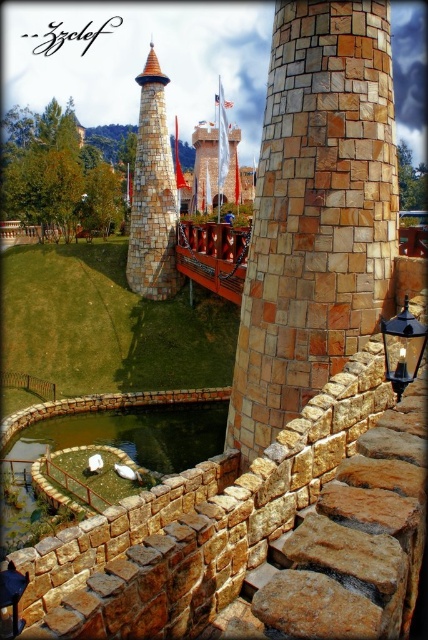
Question: Can you confirm if natural stone tower at center is bigger than black metal lantern at right?

Choices:
 (A) no
 (B) yes

Answer: (B)

Question: Can you confirm if stone textured tower at center is positioned to the left of white stone tower at center?

Choices:
 (A) yes
 (B) no

Answer: (A)

Question: Estimate the real-world distances between objects in this image. Which object is closer to the natural stone tower at center?

Choices:
 (A) stone textured tower at center
 (B) white stone tower at center
 (C) black metal lantern at right

Answer: (C)

Question: Which of the following is the farthest from the observer?

Choices:
 (A) black metal lantern at right
 (B) white stone tower at center
 (C) stone textured tower at center

Answer: (B)

Question: Which point appears closest to the camera in this image?

Choices:
 (A) (335, 28)
 (B) (157, 61)
 (C) (394, 390)

Answer: (C)

Question: Observing the image, what is the correct spatial positioning of stone textured tower at center in reference to white stone tower at center?

Choices:
 (A) above
 (B) below

Answer: (B)